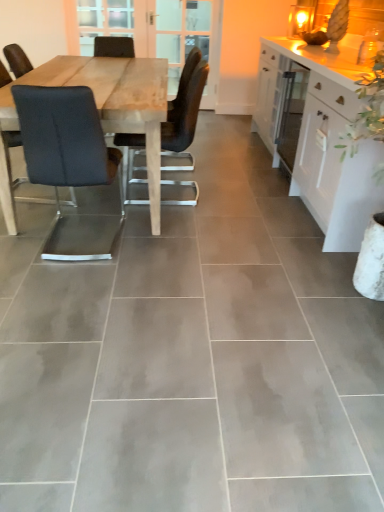
Question: Which direction should I rotate to face matte black chair at center, which is the first chair in right-to-left order, — up or down?

Choices:
 (A) up
 (B) down

Answer: (A)

Question: From a real-world perspective, is black fabric chair at left, positioned as the second chair in right-to-left order, physically above clear glass screen door at upper center, placed as the 2th screen door when sorted from left to right?

Choices:
 (A) yes
 (B) no

Answer: (B)

Question: Considering the relative sizes of black fabric chair at left, which is the first chair from left to right, and clear glass screen door at upper center, placed as the 2th screen door when sorted from left to right, in the image provided, is black fabric chair at left, which is the first chair from left to right, shorter than clear glass screen door at upper center, placed as the 2th screen door when sorted from left to right,?

Choices:
 (A) yes
 (B) no

Answer: (A)

Question: Is black fabric chair at left, positioned as the second chair in right-to-left order, oriented away from clear glass screen door at upper center, which is counted as the first screen door, starting from the right?

Choices:
 (A) yes
 (B) no

Answer: (B)

Question: Is black fabric chair at left, positioned as the second chair in right-to-left order, to the right of clear glass screen door at upper center, placed as the 2th screen door when sorted from left to right, from the viewer's perspective?

Choices:
 (A) yes
 (B) no

Answer: (B)

Question: Can you confirm if black fabric chair at left, which is the first chair from left to right, is wider than clear glass screen door at upper center, placed as the 2th screen door when sorted from left to right?

Choices:
 (A) no
 (B) yes

Answer: (B)

Question: Is black fabric chair at left, positioned as the second chair in right-to-left order, further to camera compared to clear glass screen door at upper center, which is counted as the first screen door, starting from the right?

Choices:
 (A) no
 (B) yes

Answer: (A)

Question: Is white glossy cabinet at right bigger than clear glass screen door at upper center, placed as the 2th screen door when sorted from left to right?

Choices:
 (A) no
 (B) yes

Answer: (B)

Question: Is white glossy cabinet at right wider than clear glass screen door at upper center, placed as the 2th screen door when sorted from left to right?

Choices:
 (A) no
 (B) yes

Answer: (B)

Question: Is white glossy cabinet at right thinner than clear glass screen door at upper center, placed as the 2th screen door when sorted from left to right?

Choices:
 (A) no
 (B) yes

Answer: (A)

Question: Is the depth of white glossy cabinet at right less than that of clear glass screen door at upper center, placed as the 2th screen door when sorted from left to right?

Choices:
 (A) yes
 (B) no

Answer: (A)

Question: Does white glossy cabinet at right appear on the left side of clear glass screen door at upper center, placed as the 2th screen door when sorted from left to right?

Choices:
 (A) no
 (B) yes

Answer: (A)

Question: From the image's perspective, is white glossy cabinet at right under clear glass screen door at upper center, placed as the 2th screen door when sorted from left to right?

Choices:
 (A) yes
 (B) no

Answer: (A)

Question: Does clear glass screen door at upper center, placed as the 2th screen door when sorted from left to right, appear on the right side of black fabric chair at left, positioned as the second chair in right-to-left order?

Choices:
 (A) no
 (B) yes

Answer: (B)